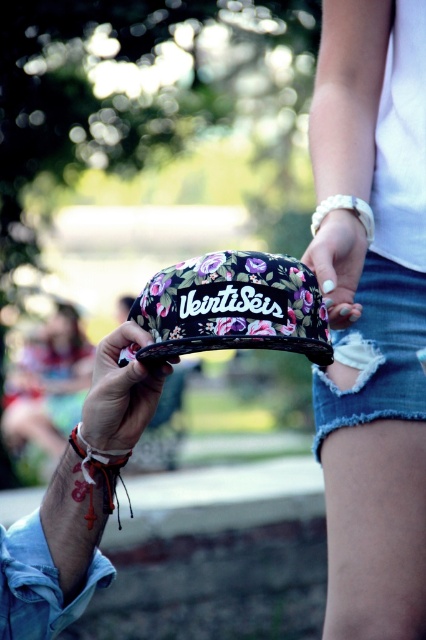
Looking at this image, you are a photographer trying to capture the interaction between the two hands in the image. To ensure the denim shorts at lower right are not in the frame, where should you position your camera relative to the scene?

The denim shorts at lower right are located at point (377, 353). To exclude them from the frame, position the camera such that the camera angle does not include this coordinate, possibly by moving the camera upward or to the left.

You are a photographer trying to capture a candid shot of the white woven bracelet at center without including the denim shorts at lower right in the frame. Based on their relative heights, is this possible?

The denim shorts at lower right is much taller than the white woven bracelet at center, so it might block the view. Therefore, capturing the white woven bracelet at center without the denim shorts at lower right in the frame might not be possible.